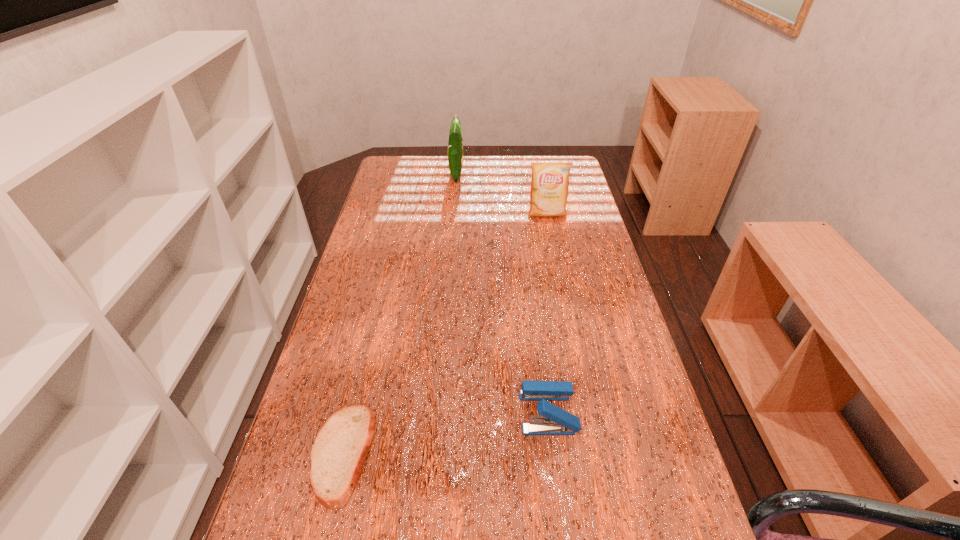
Locate an element on the screen. This screenshot has height=540, width=960. object that ranks as the third closest to the second shortest object is located at coordinates (455, 144).

Where is `free space in the image that satisfies the following two spatial constraints: 1. on the front-facing side of the stapler; 2. on the left side of the third object from right to left`? free space in the image that satisfies the following two spatial constraints: 1. on the front-facing side of the stapler; 2. on the left side of the third object from right to left is located at coordinates pos(438,412).

Where is `free space that satisfies the following two spatial constraints: 1. on the front-facing side of the second object from left to right; 2. on the back side of the third tallest object`? free space that satisfies the following two spatial constraints: 1. on the front-facing side of the second object from left to right; 2. on the back side of the third tallest object is located at coordinates (438, 412).

The image size is (960, 540). What are the coordinates of `free space that satisfies the following two spatial constraints: 1. on the front-facing side of the second shortest object; 2. on the left side of the farthest object` in the screenshot? It's located at (438, 412).

Identify the location of vacant area that satisfies the following two spatial constraints: 1. on the back side of the third tallest object; 2. on the front-facing side of the left crisp (potato chip). (517, 174).

Locate an element on the screen. The height and width of the screenshot is (540, 960). vacant point that satisfies the following two spatial constraints: 1. on the front-facing side of the third tallest object; 2. on the right side of the left crisp (potato chip) is located at coordinates (438, 412).